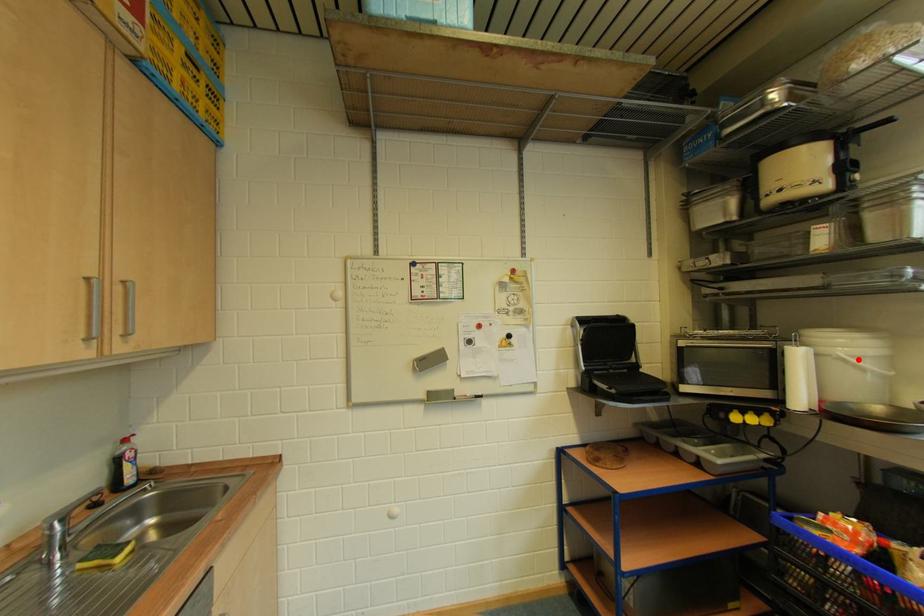
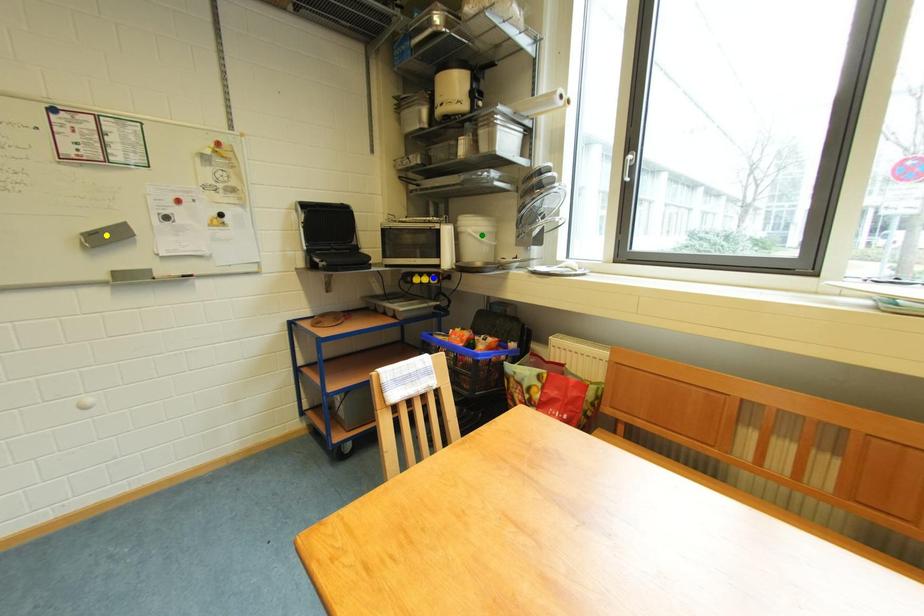
Question: I am providing you with two images of the same scene from different viewpoints. A red point is marked on the first image. You are given multiple points on the second image. Which point in image 2 represents the same 3d spot as the red point in image 1?

Choices:
 (A) green point
 (B) yellow point
 (C) blue point

Answer: (A)